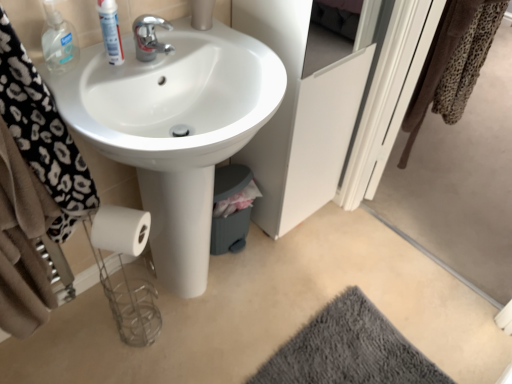
At what (x,y) coordinates should I click in order to perform the action: click on vacant area situated below gray fuzzy rug at lower right (from a real-world perspective). Please return your answer as a coordinate pair (x, y). This screenshot has height=384, width=512. Looking at the image, I should click on (349, 354).